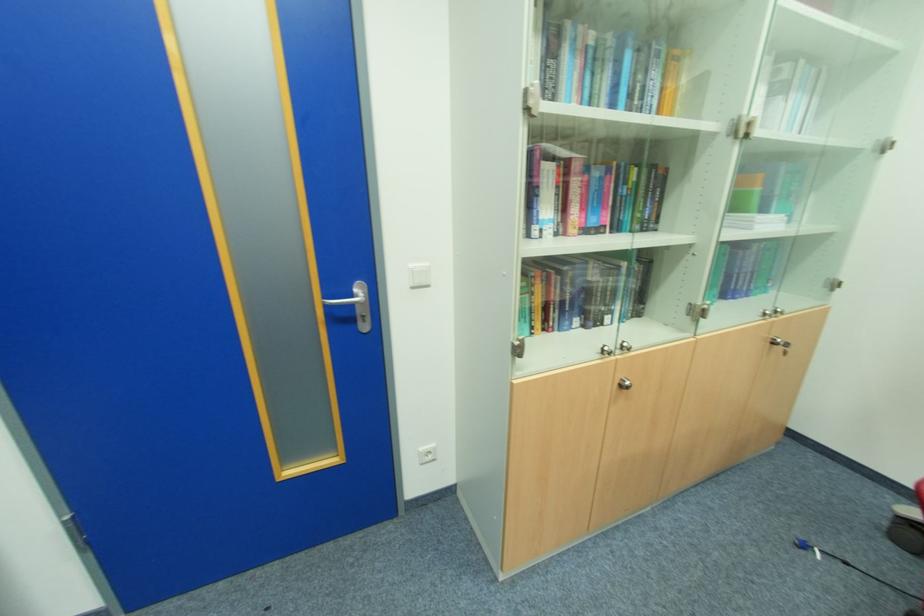
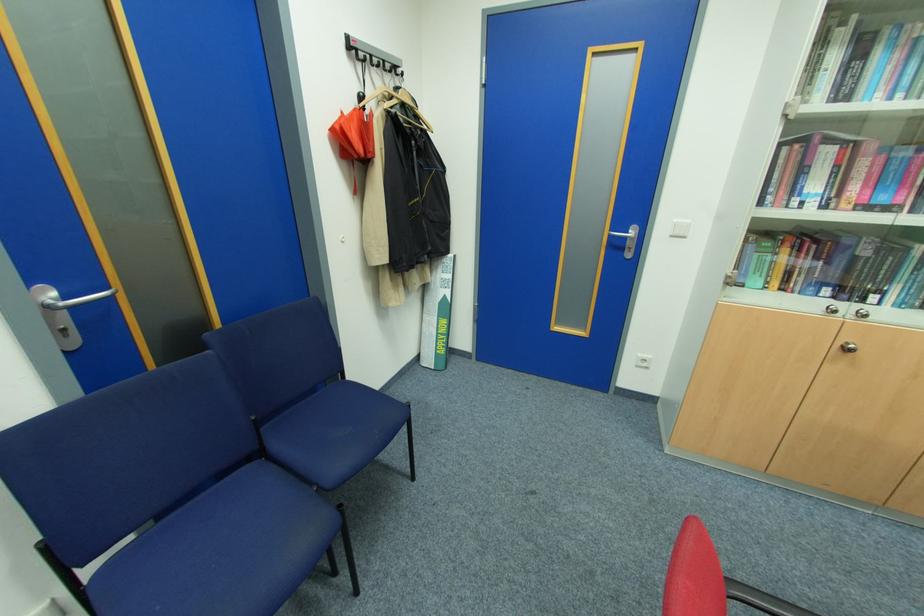
Where in the second image is the point corresponding to pixel 630 382 from the first image?

(856, 346)